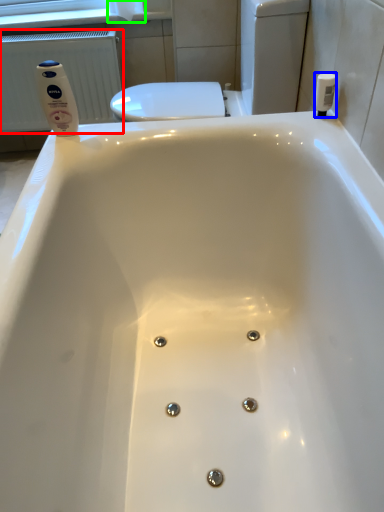
Question: Based on their relative distances, which object is farther from radiator (highlighted by a red box)? Choose from toiletry (highlighted by a blue box) and toilet paper (highlighted by a green box).

Choices:
 (A) toiletry
 (B) toilet paper

Answer: (A)